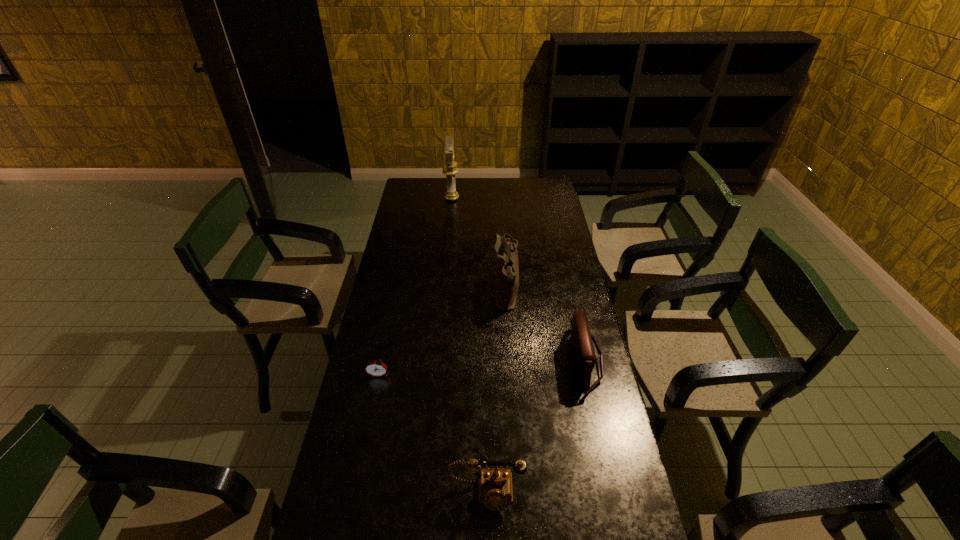
You are a GUI agent. You are given a task and a screenshot of the screen. Output one action in this format:
    pyautogui.click(x=<x>, y=<y>)
    Task: Click on the second object from left to right
    
    Given the screenshot: What is the action you would take?
    pyautogui.click(x=450, y=169)

Where is `the farthest object`? the farthest object is located at coordinates (450, 169).

Find the location of a particular element. The image size is (960, 540). the left shoulder bag is located at coordinates (507, 273).

Where is `the second farthest object`? The image size is (960, 540). the second farthest object is located at coordinates (507, 273).

I want to click on telephone, so click(x=495, y=490).

Locate an element on the screen. The width and height of the screenshot is (960, 540). the right shoulder bag is located at coordinates (581, 339).

The width and height of the screenshot is (960, 540). What are the coordinates of `the nearer shoulder bag` in the screenshot? It's located at (581, 339).

Find the location of a particular element. This screenshot has height=540, width=960. alarm clock is located at coordinates (377, 368).

Locate an element on the screen. The height and width of the screenshot is (540, 960). the leftmost object is located at coordinates (377, 368).

This screenshot has height=540, width=960. I want to click on free space located on the front-facing side of the fourth object from right to left, so click(489, 198).